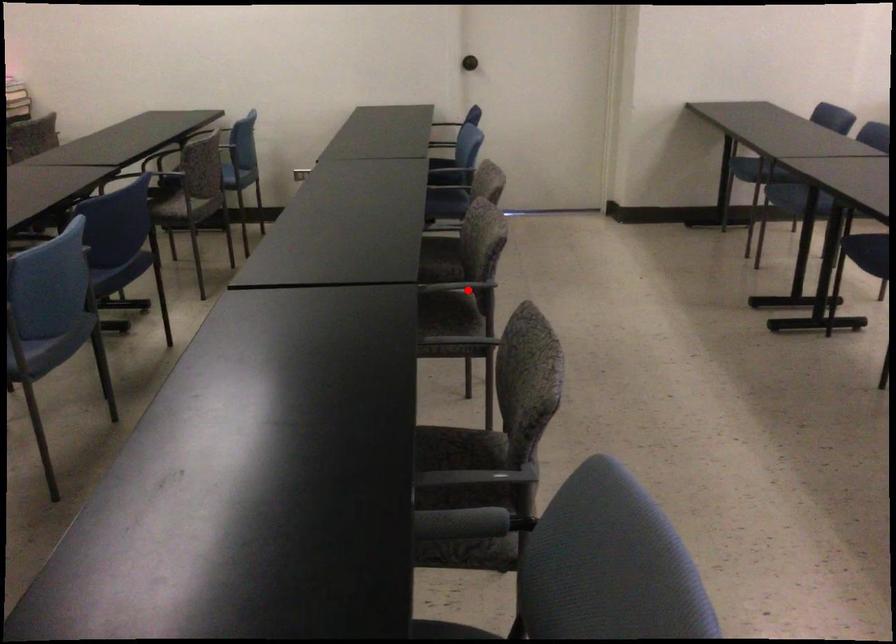
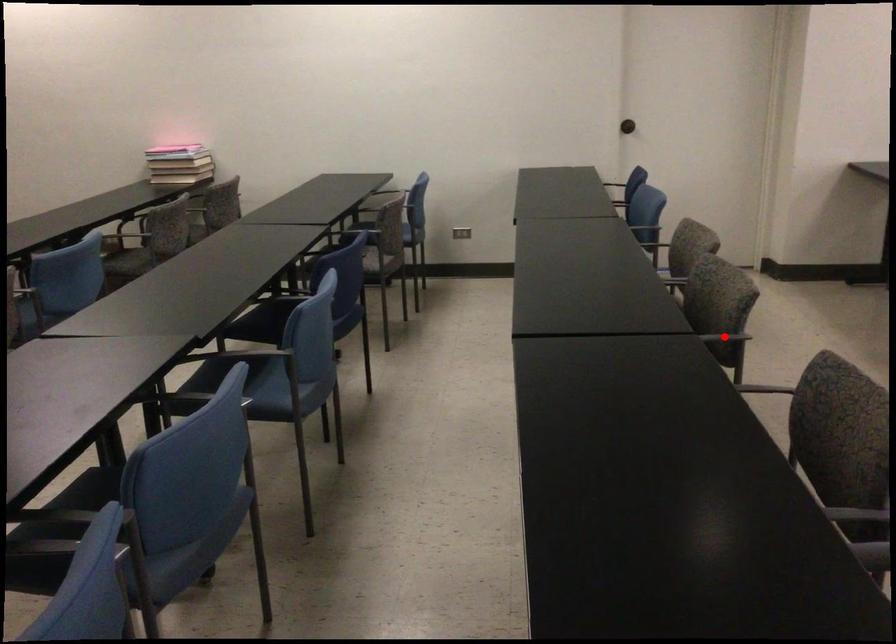
I am providing you with two images of the same scene from different viewpoints. A red point is marked on the first image and another point is marked on the second image. Are the points marked in image1 and image2 representing the same 3D position?

Yes